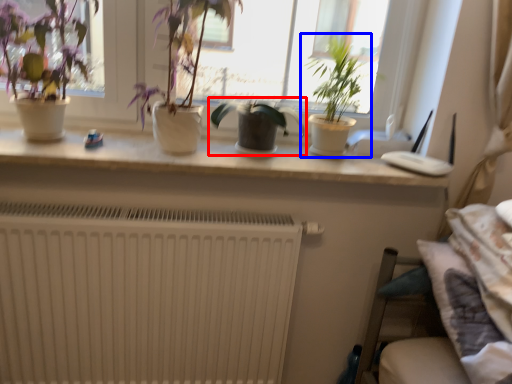
Question: Which object appears closest to the camera in this image, houseplant (highlighted by a red box) or houseplant (highlighted by a blue box)?

Choices:
 (A) houseplant
 (B) houseplant

Answer: (B)